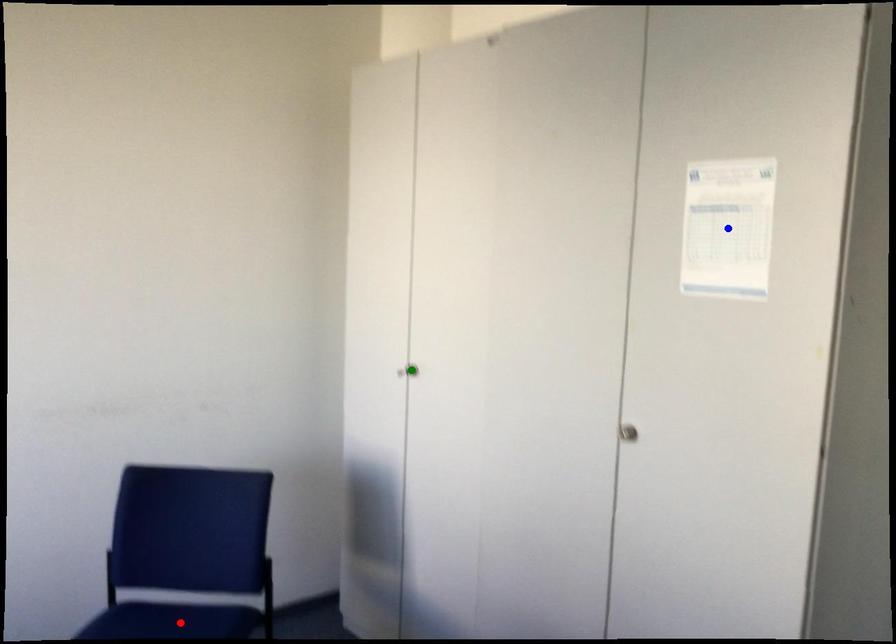
Order these from nearest to farthest:
- green point
- blue point
- red point

green point → red point → blue point